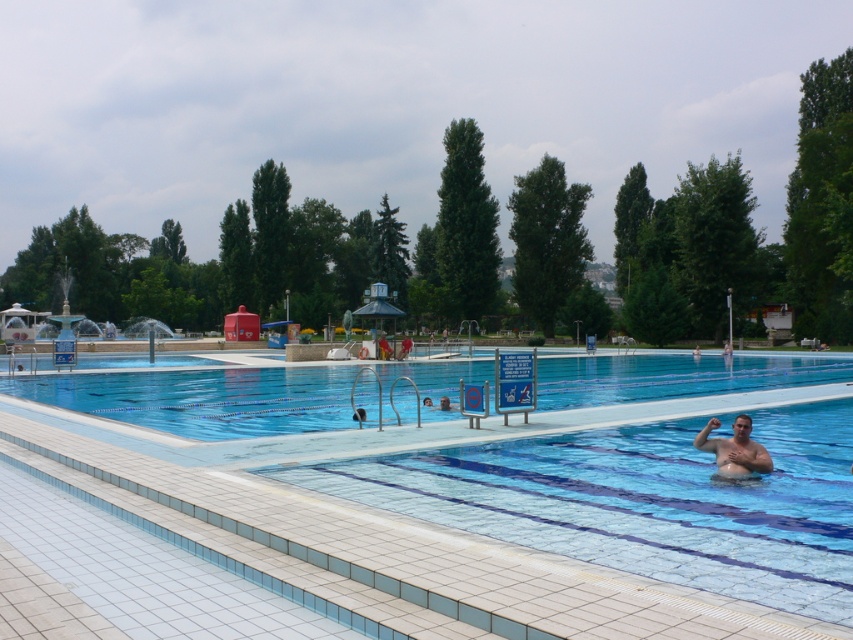
Question: Which object appears closest to the camera in this image?

Choices:
 (A) clear blue tiles at center
 (B) skinny man at center

Answer: (A)

Question: Which object appears farthest from the camera in this image?

Choices:
 (A) clear blue tiles at center
 (B) skinny man at center
 (C) transparent glass pool at center

Answer: (C)

Question: Which point is farther from the camera taking this photo?

Choices:
 (A) 722,452
 (B) 543,566

Answer: (A)

Question: Is clear blue tiles at center positioned in front of skinny man at center?

Choices:
 (A) yes
 (B) no

Answer: (A)

Question: Does transparent glass pool at center appear under skinny man at center?

Choices:
 (A) yes
 (B) no

Answer: (B)

Question: Does transparent glass pool at center appear on the right side of skinny man at center?

Choices:
 (A) no
 (B) yes

Answer: (B)